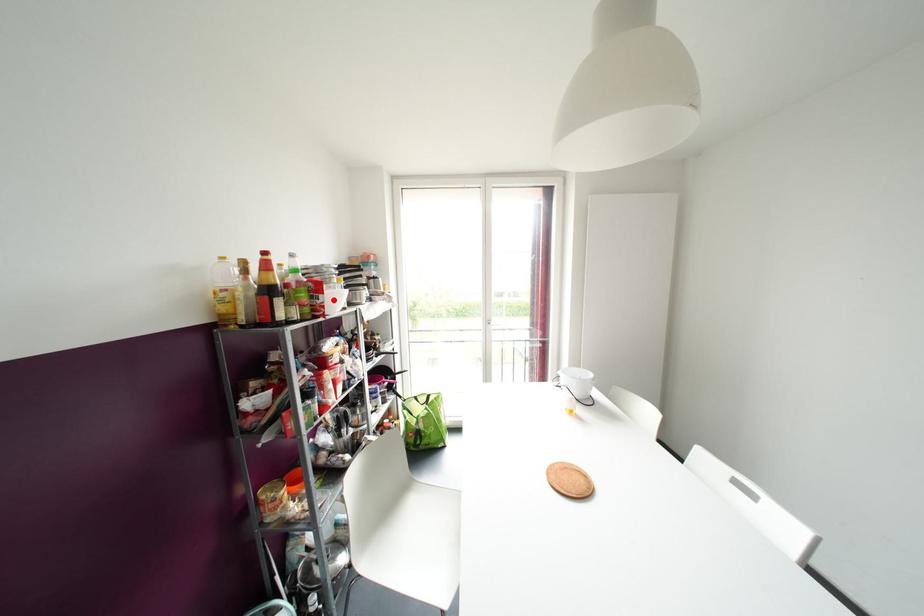
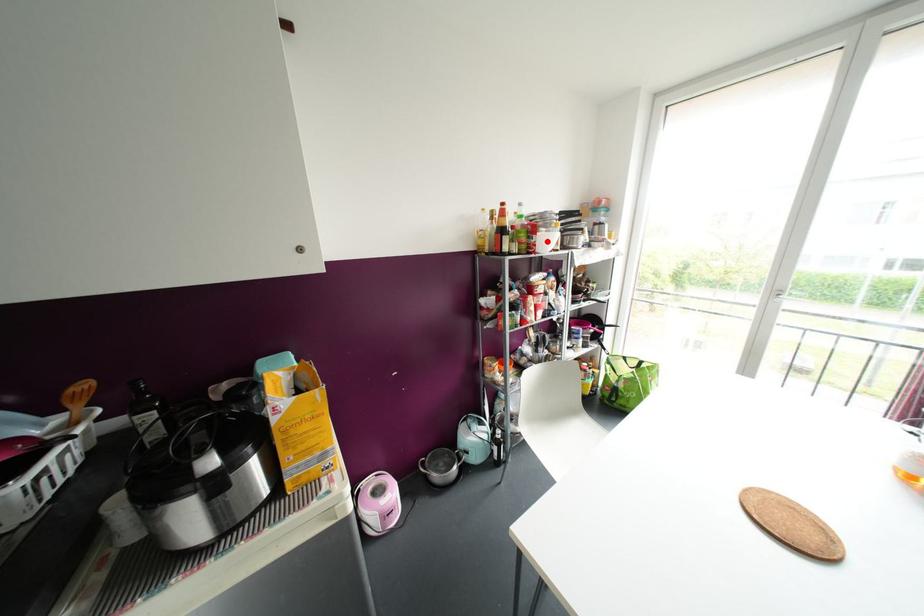
I am providing you with two images of the same scene from different viewpoints. A red point is marked on the first image and another point is marked on the second image. Are the points marked in image1 and image2 representing the same 3D position?

Yes